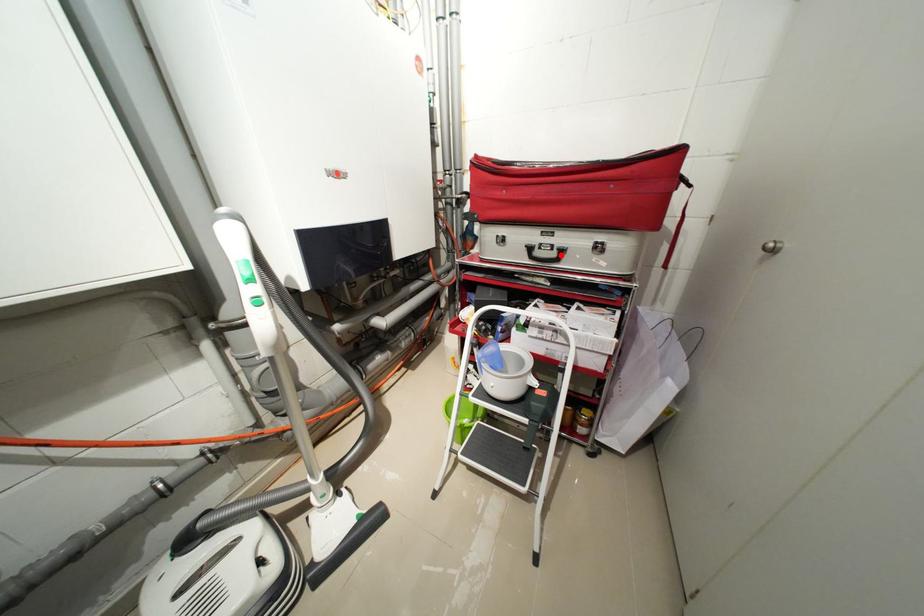
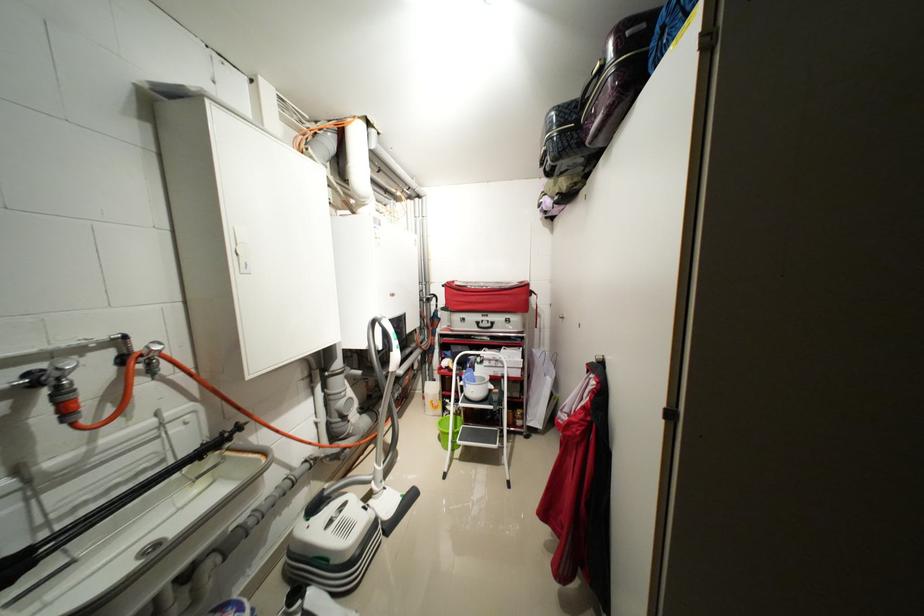
Question: I am providing you with two images of the same scene from different viewpoints. Given a red point in image1, look at the same physical point in image2. Is it:

Choices:
 (A) Closer to the viewpoint
 (B) Farther from the viewpoint

Answer: (B)